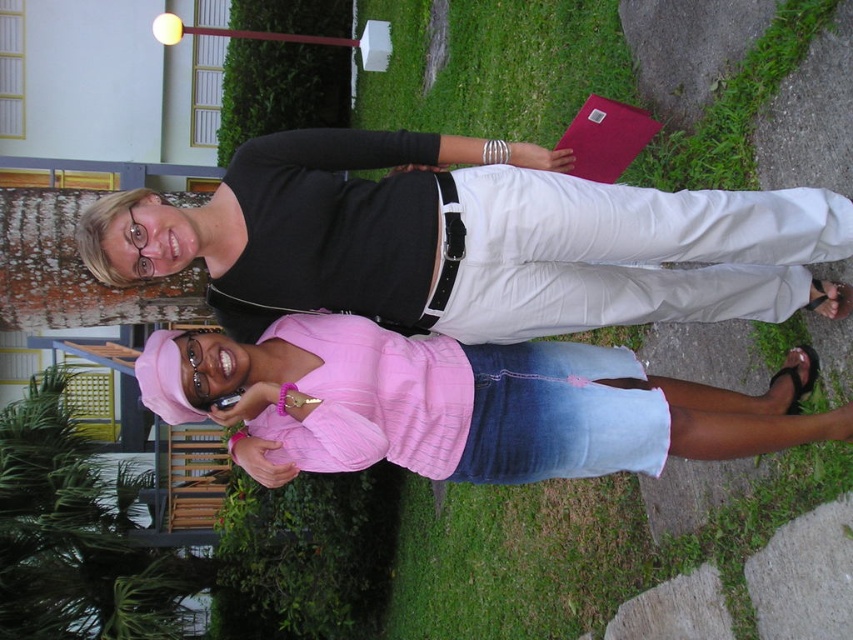
You are a photographer trying to capture a candid shot of the person in the pink top and cap. The camera you are using has a focal point at coordinate point (467, 240). Which person should you focus on to ensure the matte black shirt at center is in focus?

The focal point at coordinate point (467, 240) is set to focus on the matte black shirt at center, so you should focus on the person wearing the matte black shirt at center to ensure they are in focus.

Looking at this image, you are a fashion designer observing two people in a park. You notice the matte black shirt at center and the pink fabric shirt at center. Which one has a wider width?

The matte black shirt at center has a wider width than the pink fabric shirt at center.

You are standing in a garden and see two people wearing shirts. The first is a matte black shirt at center and the second is a pink fabric shirt at center. Which one is positioned more to the left?

The matte black shirt at center is positioned to the left of the pink fabric shirt at center, so it is more to the left.